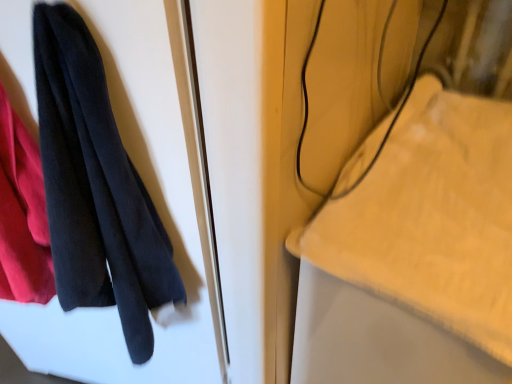
Question: Would you say yellow plush towel at upper right is inside or outside black cotton towel at left?

Choices:
 (A) outside
 (B) inside

Answer: (A)

Question: Based on their sizes in the image, would you say yellow plush towel at upper right is bigger or smaller than black cotton towel at left?

Choices:
 (A) big
 (B) small

Answer: (A)

Question: Is point (308, 241) closer or farther from the camera than point (49, 97)?

Choices:
 (A) closer
 (B) farther

Answer: (B)

Question: Would you say black cotton towel at left is to the left or to the right of yellow plush towel at upper right in the picture?

Choices:
 (A) right
 (B) left

Answer: (B)

Question: Relative to yellow plush towel at upper right, is black cotton towel at left in front or behind?

Choices:
 (A) behind
 (B) front

Answer: (B)

Question: Choose the correct answer: Is black cotton towel at left inside yellow plush towel at upper right or outside it?

Choices:
 (A) outside
 (B) inside

Answer: (A)

Question: From their relative heights in the image, would you say black cotton towel at left is taller or shorter than yellow plush towel at upper right?

Choices:
 (A) tall
 (B) short

Answer: (B)